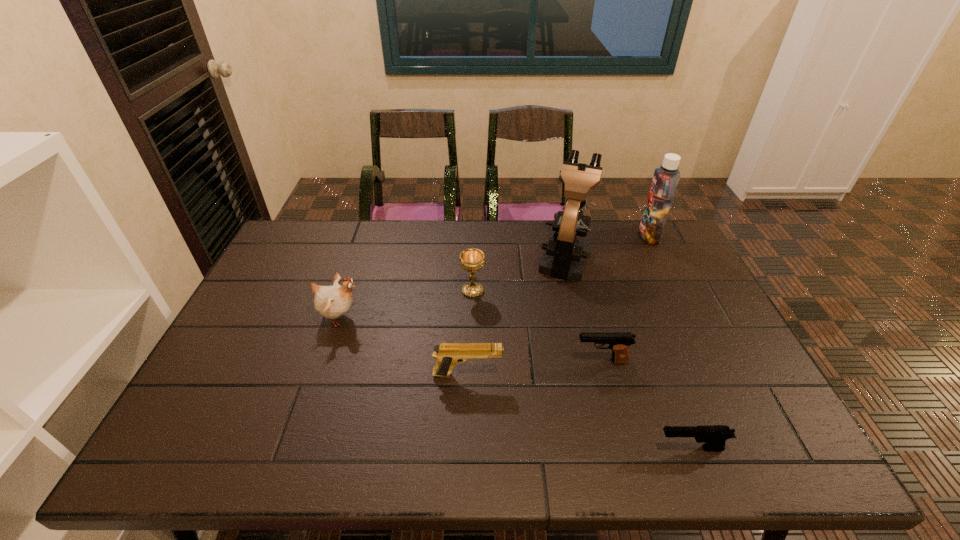
Identify the location of free space located on the front-facing side of the rightmost pistol. (569, 448).

Where is `vacant space located 0.130m on the front-facing side of the rightmost pistol`? This screenshot has height=540, width=960. vacant space located 0.130m on the front-facing side of the rightmost pistol is located at coordinates (597, 448).

Image resolution: width=960 pixels, height=540 pixels. I want to click on vacant area situated 0.160m on the front-facing side of the rightmost pistol, so click(x=583, y=448).

Image resolution: width=960 pixels, height=540 pixels. What are the coordinates of `microscope that is at the far edge` in the screenshot? It's located at (565, 257).

At what (x,y) coordinates should I click in order to perform the action: click on shampoo that is positioned at the far edge. Please return your answer as a coordinate pair (x, y). Looking at the image, I should click on coord(666,178).

The image size is (960, 540). In order to click on object located in the near edge section of the desktop in this screenshot , I will do `click(713, 436)`.

The image size is (960, 540). In order to click on shampoo located at the right edge in this screenshot , I will do `click(666, 178)`.

Where is `pistol that is at the right edge`? pistol that is at the right edge is located at coordinates (713, 436).

The width and height of the screenshot is (960, 540). What are the coordinates of `object at the far right corner` in the screenshot? It's located at point(666,178).

This screenshot has height=540, width=960. What are the coordinates of `object situated at the near right corner` in the screenshot? It's located at (713, 436).